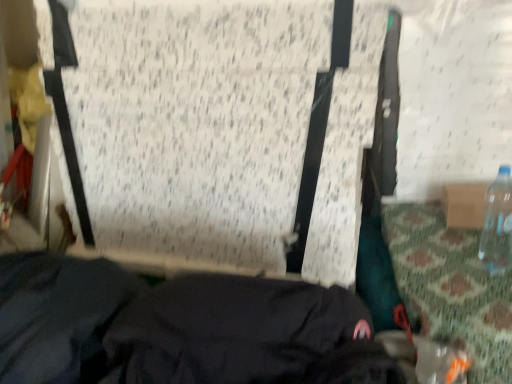
Locate an element on the screen. This screenshot has height=384, width=512. clear plastic bottle at right is located at coordinates (498, 224).

The image size is (512, 384). Describe the element at coordinates (498, 224) in the screenshot. I see `clear plastic bottle at right` at that location.

Describe the element at coordinates (176, 328) in the screenshot. I see `black fabric at lower center` at that location.

In order to click on black fabric at lower center in this screenshot , I will do `click(176, 328)`.

Image resolution: width=512 pixels, height=384 pixels. Identify the location of clear plastic bottle at right. (498, 224).

Is black fabric at lower center to the left or to the right of clear plastic bottle at right in the image?

black fabric at lower center is positioned on clear plastic bottle at right's left side.

Considering the positions of objects black fabric at lower center and clear plastic bottle at right in the image provided, who is in front, black fabric at lower center or clear plastic bottle at right?

Positioned in front is black fabric at lower center.

Is point (25, 273) farther from viewer compared to point (503, 240)?

No, it is not.

From the image's perspective, which object appears higher, black fabric at lower center or clear plastic bottle at right?

clear plastic bottle at right appears higher in the image.

From a real-world perspective, which object stands above the other?

From a 3D spatial view, clear plastic bottle at right is above.

Looking at this image, between black fabric at lower center and clear plastic bottle at right, which one has smaller width?

With smaller width is clear plastic bottle at right.

Is black fabric at lower center shorter than clear plastic bottle at right?

Incorrect, the height of black fabric at lower center does not fall short of that of clear plastic bottle at right.

Based on their sizes in the image, would you say black fabric at lower center is bigger or smaller than clear plastic bottle at right?

black fabric at lower center is bigger than clear plastic bottle at right.

Is black fabric at lower center not inside clear plastic bottle at right?

black fabric at lower center lies outside clear plastic bottle at right's area.

Consider the image. Is black fabric at lower center not near clear plastic bottle at right?

No, there isn't a large distance between black fabric at lower center and clear plastic bottle at right.

Is black fabric at lower center oriented away from clear plastic bottle at right?

No, black fabric at lower center's orientation is not away from clear plastic bottle at right.

What's the angular difference between black fabric at lower center and clear plastic bottle at right's facing directions?

There is a 8.34-degree angle between the facing directions of black fabric at lower center and clear plastic bottle at right.

Identify the location of clothing on the left of clear plastic bottle at right. The width and height of the screenshot is (512, 384). (176, 328).

Considering the positions of objects clear plastic bottle at right and black fabric at lower center in the image provided, who is more to the left, clear plastic bottle at right or black fabric at lower center?

black fabric at lower center.

Which object is closer to the camera taking this photo, clear plastic bottle at right or black fabric at lower center?

black fabric at lower center is in front.

Which is more distant, (503, 247) or (67, 305)?

Positioned behind is point (503, 247).

From the image's perspective, is clear plastic bottle at right above or below black fabric at lower center?

From the image's perspective, clear plastic bottle at right appears above black fabric at lower center.

From a real-world perspective, is clear plastic bottle at right positioned under black fabric at lower center based on gravity?

No, from a real-world perspective, clear plastic bottle at right is not below black fabric at lower center.

Consider the image. Can you confirm if clear plastic bottle at right is wider than black fabric at lower center?

In fact, clear plastic bottle at right might be narrower than black fabric at lower center.

Is clear plastic bottle at right taller or shorter than black fabric at lower center?

Clearly, clear plastic bottle at right is shorter compared to black fabric at lower center.

Which of these two, clear plastic bottle at right or black fabric at lower center, is smaller?

clear plastic bottle at right is smaller.

Would you say clear plastic bottle at right is inside or outside black fabric at lower center?

clear plastic bottle at right lies outside black fabric at lower center.

Consider the image. Are clear plastic bottle at right and black fabric at lower center beside each other?

No, clear plastic bottle at right is not touching black fabric at lower center.

Could you tell me if clear plastic bottle at right is turned towards black fabric at lower center?

No, clear plastic bottle at right is not turned towards black fabric at lower center.

How different are the orientations of clear plastic bottle at right and black fabric at lower center in degrees?

→ The angle between the facing direction of clear plastic bottle at right and the facing direction of black fabric at lower center is 8.34 degrees.

At what (x,y) coordinates should I click in order to perform the action: click on bottle lying above the black fabric at lower center (from the image's perspective). Please return your answer as a coordinate pair (x, y). The image size is (512, 384). Looking at the image, I should click on (498, 224).

Find the location of a particular element. This screenshot has height=384, width=512. bottle behind the black fabric at lower center is located at coordinates (498, 224).

Where is `clothing located on the left of clear plastic bottle at right`? This screenshot has width=512, height=384. clothing located on the left of clear plastic bottle at right is located at coordinates (176, 328).